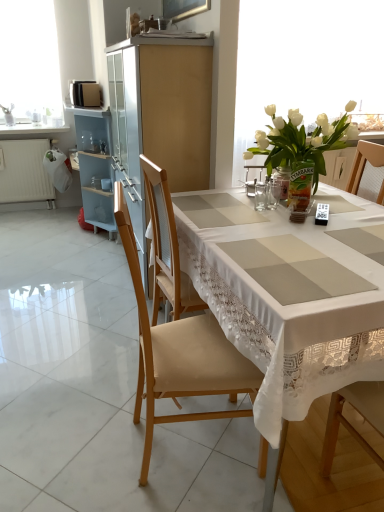
Identify the location of vacant area that is situated to the right of translucent glass vase at upper right. This screenshot has width=384, height=512. (349, 207).